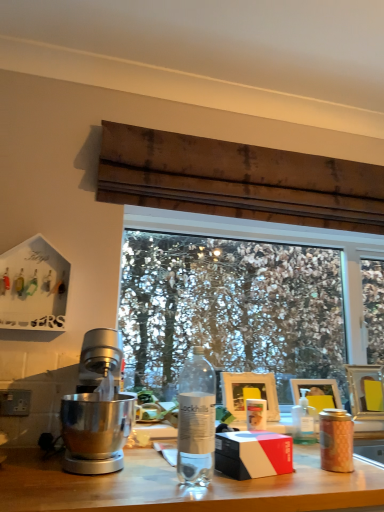
Question: Can you confirm if polished silver mixer at left is wider than clear plastic bottle at center, which is the first bottle from right to left?

Choices:
 (A) yes
 (B) no

Answer: (A)

Question: Can you confirm if polished silver mixer at left is taller than clear plastic bottle at center, positioned as the second bottle in left-to-right order?

Choices:
 (A) yes
 (B) no

Answer: (A)

Question: Would you say polished silver mixer at left is a long distance from clear plastic bottle at center, which is the second bottle from front to back?

Choices:
 (A) no
 (B) yes

Answer: (A)

Question: Is polished silver mixer at left closer to the viewer compared to clear plastic bottle at center, the 1th bottle in the back-to-front sequence?

Choices:
 (A) no
 (B) yes

Answer: (B)

Question: Is polished silver mixer at left positioned beyond the bounds of clear plastic bottle at center, the second bottle from the top?

Choices:
 (A) no
 (B) yes

Answer: (B)

Question: Considering the positions of point (345, 438) and point (253, 475), is point (345, 438) closer or farther from the camera than point (253, 475)?

Choices:
 (A) farther
 (B) closer

Answer: (A)

Question: Would you say matte gold canister at right, which ranks as the 1th coffee cup in front-to-back order, is inside or outside matte black box at center?

Choices:
 (A) outside
 (B) inside

Answer: (A)

Question: From the image's perspective, is matte gold canister at right, which is counted as the second coffee cup, starting from the left, above or below matte black box at center?

Choices:
 (A) above
 (B) below

Answer: (A)

Question: Based on their sizes in the image, would you say matte gold canister at right, which appears as the second coffee cup when viewed from the back, is bigger or smaller than matte black box at center?

Choices:
 (A) small
 (B) big

Answer: (A)

Question: In terms of size, does pink matte coffee cup at center, the 2th coffee cup from the right, appear bigger or smaller than white matte picture frame at center, which is the 1th picture frame in left-to-right order?

Choices:
 (A) big
 (B) small

Answer: (B)

Question: From a real-world perspective, is pink matte coffee cup at center, the 2th coffee cup from the right, physically located above or below white matte picture frame at center, the third picture frame from the right?

Choices:
 (A) above
 (B) below

Answer: (B)

Question: Does point (256, 429) appear closer or farther from the camera than point (230, 408)?

Choices:
 (A) closer
 (B) farther

Answer: (A)

Question: Choose the correct answer: Is pink matte coffee cup at center, arranged as the 1th coffee cup when viewed from the left, inside white matte picture frame at center, the third picture frame from the right, or outside it?

Choices:
 (A) outside
 (B) inside

Answer: (A)

Question: From a real-world perspective, relative to clear glass bottle at center, placed as the first bottle when sorted from top to bottom, is transparent glass window at center vertically above or below?

Choices:
 (A) above
 (B) below

Answer: (A)

Question: Is transparent glass window at center in front of or behind clear glass bottle at center, the first bottle in the left-to-right sequence, in the image?

Choices:
 (A) front
 (B) behind

Answer: (B)